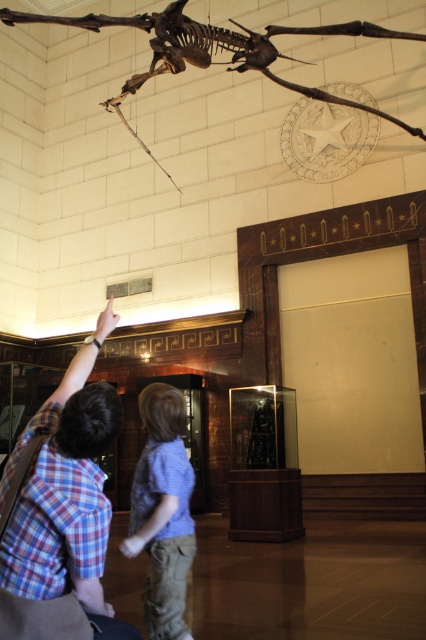
The width and height of the screenshot is (426, 640). What are the coordinates of `plaid shirt at lower left` in the screenshot? It's located at (66, 493).

Image resolution: width=426 pixels, height=640 pixels. In order to click on plaid shirt at lower left in this screenshot , I will do `click(66, 493)`.

Who is higher up, plaid shirt at lower left or brown bone-like at upper center?

brown bone-like at upper center is above.

Which of these two, plaid shirt at lower left or brown bone-like at upper center, stands shorter?

With less height is brown bone-like at upper center.

Measure the distance between plaid shirt at lower left and camera.

They are 7.42 feet apart.

What are the coordinates of `plaid shirt at lower left` in the screenshot? It's located at (66, 493).

Between blue cotton shirt at center and brown bone-like at upper center, which one appears on the left side from the viewer's perspective?

blue cotton shirt at center is more to the left.

This screenshot has height=640, width=426. Identify the location of blue cotton shirt at center. (163, 512).

Who is more forward, (146, 480) or (423, 35)?

Positioned in front is point (146, 480).

I want to click on blue cotton shirt at center, so click(163, 512).